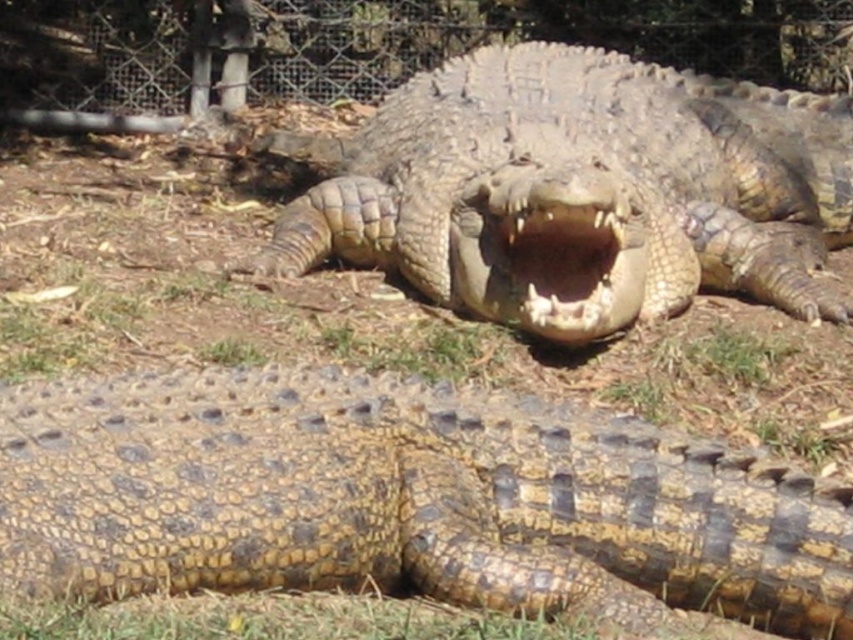
What are the coordinates of `leathery brown crocodile at center` in the screenshot? It's located at (584, 192).

Is point (730, 209) farther from camera compared to point (590, 221)?

Yes, it is behind point (590, 221).

Is point (595, 234) less distant than point (552, 250)?

Yes.

You are a GUI agent. You are given a task and a screenshot of the screen. Output one action in this format:
    pyautogui.click(x=<x>, y=<y>)
    Task: Click on the leathery brown crocodile at center
    
    Given the screenshot: What is the action you would take?
    click(584, 192)

Is yellowish-brown scaly skin at center smaller than leathery brown crocodile at center?

Yes.

From the picture: Is yellowish-brown scaly skin at center to the right of leathery brown crocodile at center from the viewer's perspective?

In fact, yellowish-brown scaly skin at center is to the left of leathery brown crocodile at center.

Does point (792, 518) lie in front of point (618, 163)?

Yes, it is in front of point (618, 163).

Locate an element on the screen. This screenshot has width=853, height=640. yellowish-brown scaly skin at center is located at coordinates (404, 499).

Does yellowish-brown scaly skin at center have a lesser width compared to brown scaly mouth at center?

No, yellowish-brown scaly skin at center is not thinner than brown scaly mouth at center.

Is point (277, 490) farther from camera compared to point (540, 312)?

No.

Is point (322, 456) more distant than point (532, 321)?

No, (322, 456) is closer to viewer.

Where is `yellowish-brown scaly skin at center`? The width and height of the screenshot is (853, 640). yellowish-brown scaly skin at center is located at coordinates (404, 499).